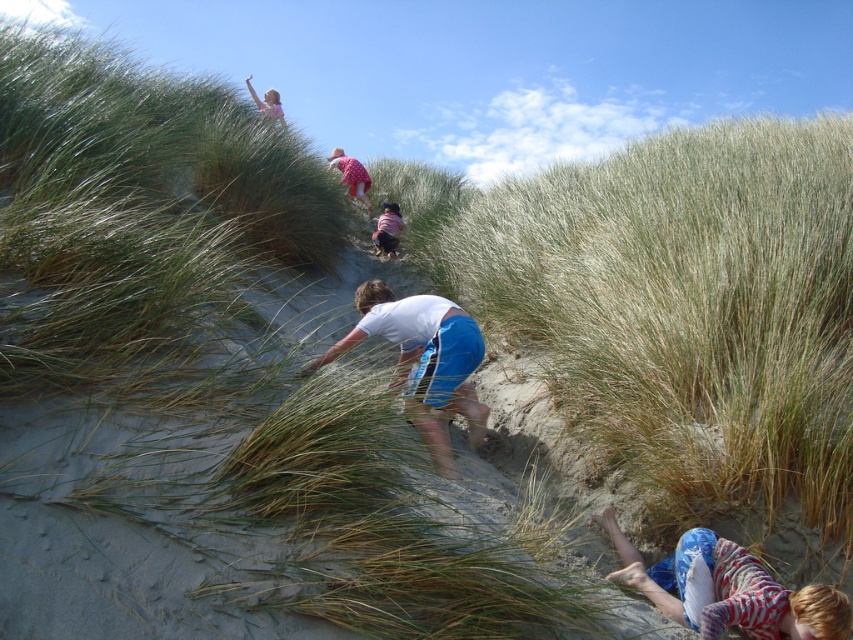
Question: Considering the real-world distances, which object is farthest from the dark purple shirt at center?

Choices:
 (A) white cotton shirt at center
 (B) pink fabric dress at upper center
 (C) striped cotton shirt at lower right

Answer: (C)

Question: Which object appears closest to the camera in this image?

Choices:
 (A) dark purple shirt at center
 (B) pink fabric dress at upper center
 (C) white cotton shirt at center
 (D) striped cotton shirt at lower right

Answer: (D)

Question: Does striped cotton shirt at lower right appear under white cotton shirt at center?

Choices:
 (A) yes
 (B) no

Answer: (A)

Question: Can you confirm if striped cotton shirt at lower right is thinner than dark purple shirt at center?

Choices:
 (A) no
 (B) yes

Answer: (A)

Question: Is white cotton shirt at center to the left of dark purple shirt at center from the viewer's perspective?

Choices:
 (A) yes
 (B) no

Answer: (B)

Question: Among these objects, which one is farthest from the camera?

Choices:
 (A) white cotton shirt at center
 (B) pink fabric dress at upper center

Answer: (B)